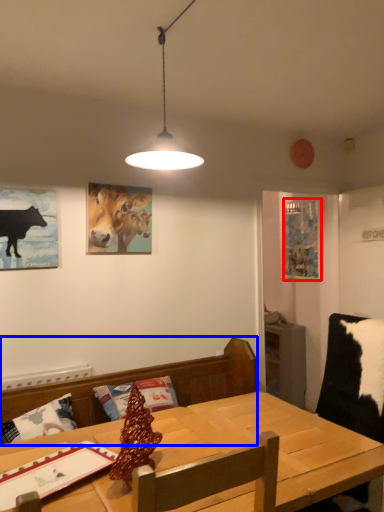
Question: Among these objects, which one is nearest to the camera, picture frame (highlighted by a red box) or brown (highlighted by a blue box)?

Choices:
 (A) picture frame
 (B) brown

Answer: (B)